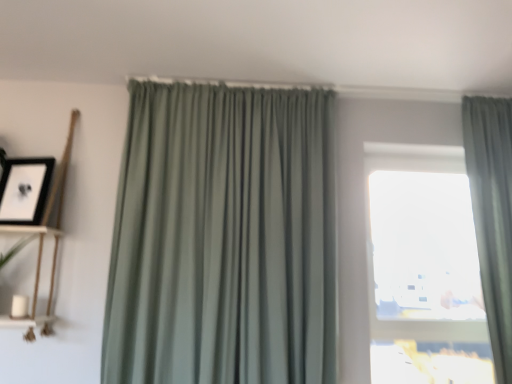
Question: Is sage green drapery at right, which appears as the first curtain when viewed from the right, oriented towards black matte picture frame at upper left?

Choices:
 (A) no
 (B) yes

Answer: (A)

Question: Is sage green drapery at right, which appears as the first curtain when viewed from the right, in contact with black matte picture frame at upper left?

Choices:
 (A) yes
 (B) no

Answer: (B)

Question: Is sage green drapery at right, which appears as the first curtain when viewed from the right, shorter than black matte picture frame at upper left?

Choices:
 (A) yes
 (B) no

Answer: (B)

Question: Is sage green drapery at right, which appears as the first curtain when viewed from the right, further to the viewer compared to black matte picture frame at upper left?

Choices:
 (A) yes
 (B) no

Answer: (B)

Question: Is sage green drapery at right, which is the 2th curtain from left to right, at the right side of black matte picture frame at upper left?

Choices:
 (A) yes
 (B) no

Answer: (A)

Question: Is sage green drapery at right, which appears as the first curtain when viewed from the right, bigger than black matte picture frame at upper left?

Choices:
 (A) yes
 (B) no

Answer: (A)

Question: Is white matte shelf at left, placed as the first shelf when sorted from bottom to top, not close to sage green drapery at right, which appears as the first curtain when viewed from the right?

Choices:
 (A) yes
 (B) no

Answer: (A)

Question: Can you confirm if white matte shelf at left, acting as the 2th shelf starting from the top, is bigger than sage green drapery at right, which appears as the first curtain when viewed from the right?

Choices:
 (A) no
 (B) yes

Answer: (A)

Question: Is white matte shelf at left, placed as the first shelf when sorted from bottom to top, closer to the viewer compared to sage green drapery at right, which appears as the first curtain when viewed from the right?

Choices:
 (A) yes
 (B) no

Answer: (A)

Question: Considering the relative positions of white matte shelf at left, placed as the first shelf when sorted from bottom to top, and sage green drapery at right, which appears as the first curtain when viewed from the right, in the image provided, is white matte shelf at left, placed as the first shelf when sorted from bottom to top, to the right of sage green drapery at right, which appears as the first curtain when viewed from the right, from the viewer's perspective?

Choices:
 (A) no
 (B) yes

Answer: (A)

Question: Is white matte shelf at left, acting as the 2th shelf starting from the top, oriented away from sage green drapery at right, which is the 2th curtain from left to right?

Choices:
 (A) yes
 (B) no

Answer: (B)

Question: From a real-world perspective, is white matte shelf at left, placed as the first shelf when sorted from bottom to top, below sage green drapery at right, which appears as the first curtain when viewed from the right?

Choices:
 (A) no
 (B) yes

Answer: (B)

Question: From a real-world perspective, is wooden shelf at left, which appears as the 1th shelf when viewed from the top, over white matte shelf at left, placed as the first shelf when sorted from bottom to top?

Choices:
 (A) no
 (B) yes

Answer: (B)